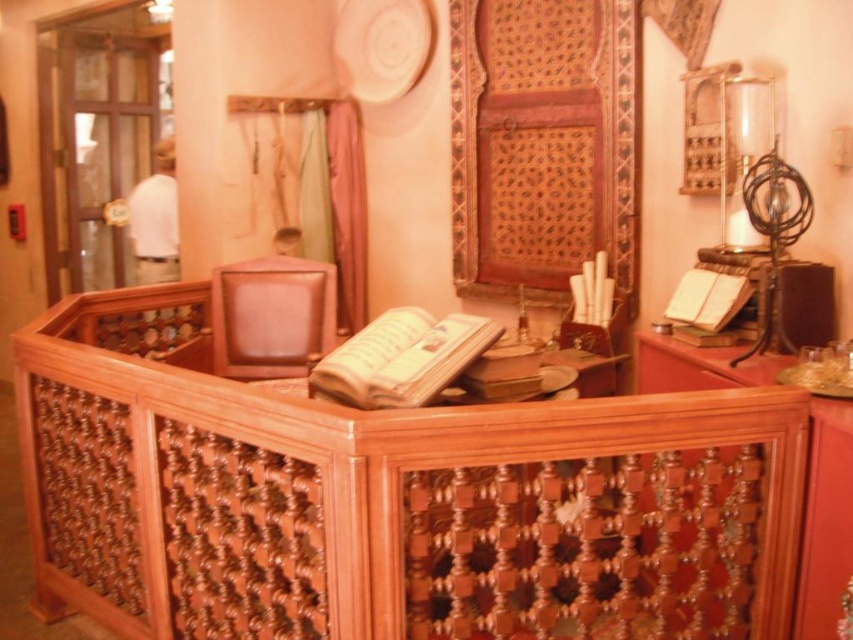
Question: Does matte brown book at center appear under white paper book at right?

Choices:
 (A) no
 (B) yes

Answer: (B)

Question: Can you confirm if wooden cabinet at center is wider than clear glass globe at upper right?

Choices:
 (A) yes
 (B) no

Answer: (B)

Question: Which is farther from the clear glass cylinder at right?

Choices:
 (A) matte brown book at right
 (B) wooden cabinet at center
 (C) matte brown book at center

Answer: (C)

Question: Estimate the real-world distances between objects in this image. Which object is farther from the white paper book at right?

Choices:
 (A) matte brown book at center
 (B) matte brown book at right
 (C) leather at center
 (D) wooden cabinet at center

Answer: (C)

Question: Which point is closer to the camera?

Choices:
 (A) wooden cabinet at center
 (B) white paper book at right
 (C) matte brown book at right

Answer: (A)

Question: Can you confirm if clear glass globe at upper right is positioned to the left of matte brown book at right?

Choices:
 (A) no
 (B) yes

Answer: (A)